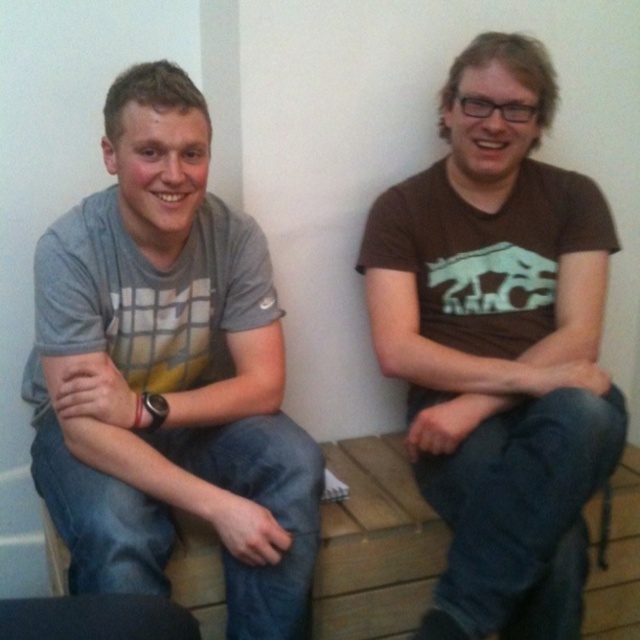
Question: Can you confirm if brown matte t-shirt at center is bigger than black matte laptop at lower left?

Choices:
 (A) yes
 (B) no

Answer: (A)

Question: Does gray cotton t-shirt at left appear on the left side of black matte laptop at lower left?

Choices:
 (A) no
 (B) yes

Answer: (B)

Question: Considering the real-world distances, which object is closest to the gray cotton t-shirt at left?

Choices:
 (A) black matte laptop at lower left
 (B) brown matte t-shirt at center

Answer: (A)

Question: Which object is farther from the camera taking this photo?

Choices:
 (A) black matte laptop at lower left
 (B) brown matte t-shirt at center

Answer: (B)

Question: Which of these objects is positioned farthest from the black matte laptop at lower left?

Choices:
 (A) gray cotton t-shirt at left
 (B) brown matte t-shirt at center

Answer: (B)

Question: Does gray cotton t-shirt at left lie behind brown matte t-shirt at center?

Choices:
 (A) yes
 (B) no

Answer: (B)